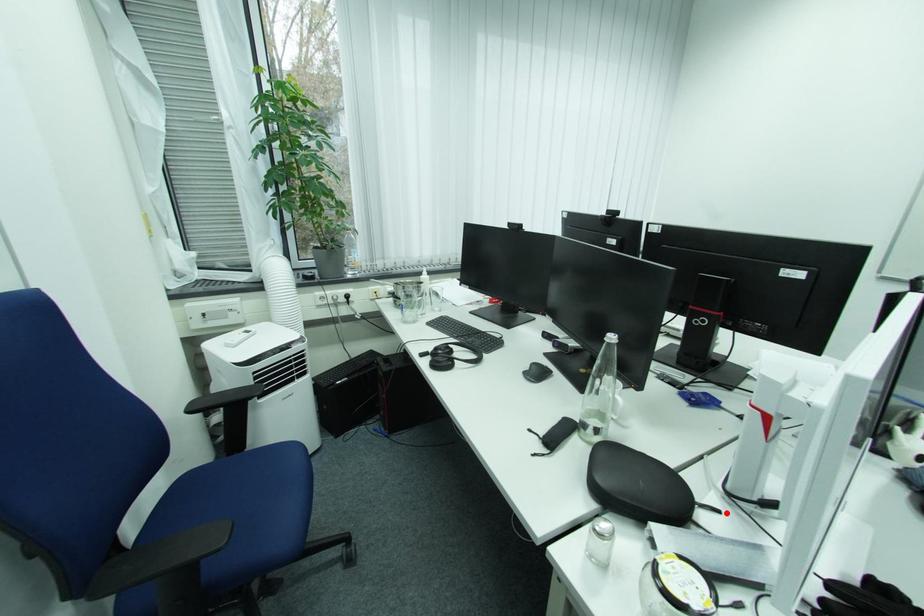
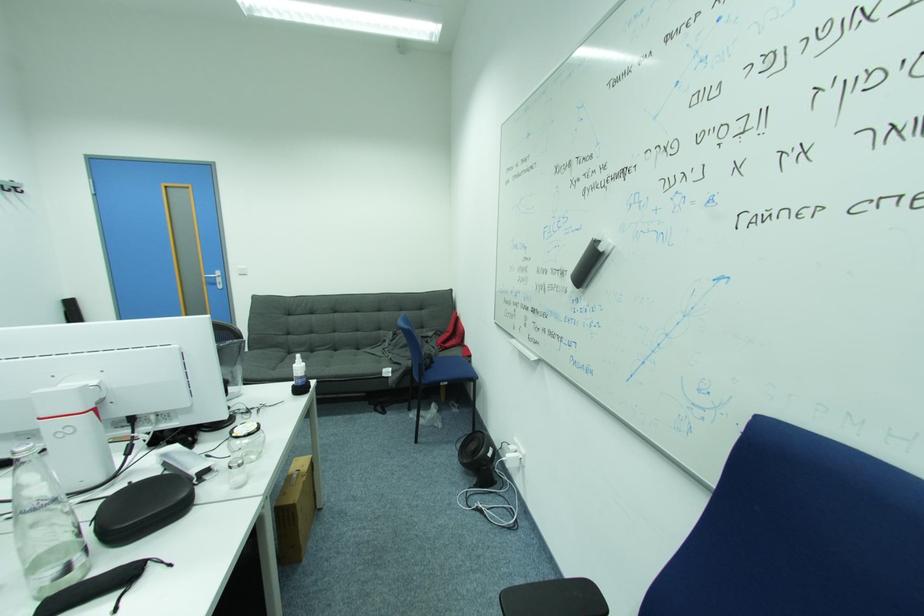
In the second image, find the point that corresponds to the highlighted location in the first image.

(138, 484)